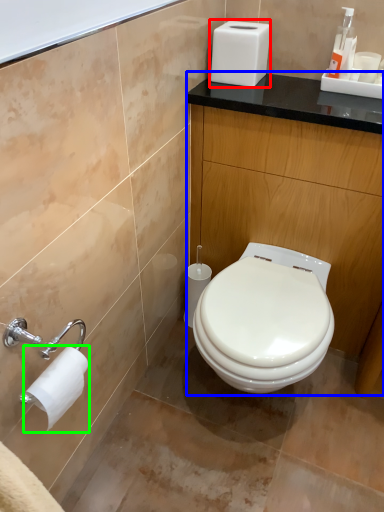
Question: Estimate the real-world distances between objects in this image. Which object is closer to appliance (highlighted by a red box), counter (highlighted by a blue box) or toilet paper (highlighted by a green box)?

Choices:
 (A) counter
 (B) toilet paper

Answer: (A)